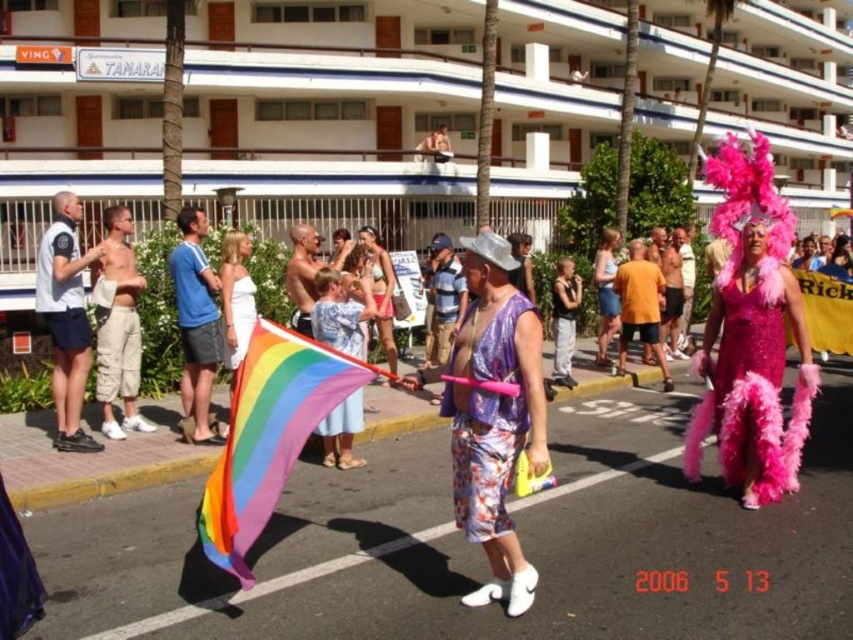
You are a photographer at the event and want to capture both the tan cargo shorts at left and the black fabric dress at center in the same frame. Which clothing item takes up more horizontal space in the photo?

The tan cargo shorts at left takes up more horizontal space in the photo because its width is larger than the black fabric dress at center.